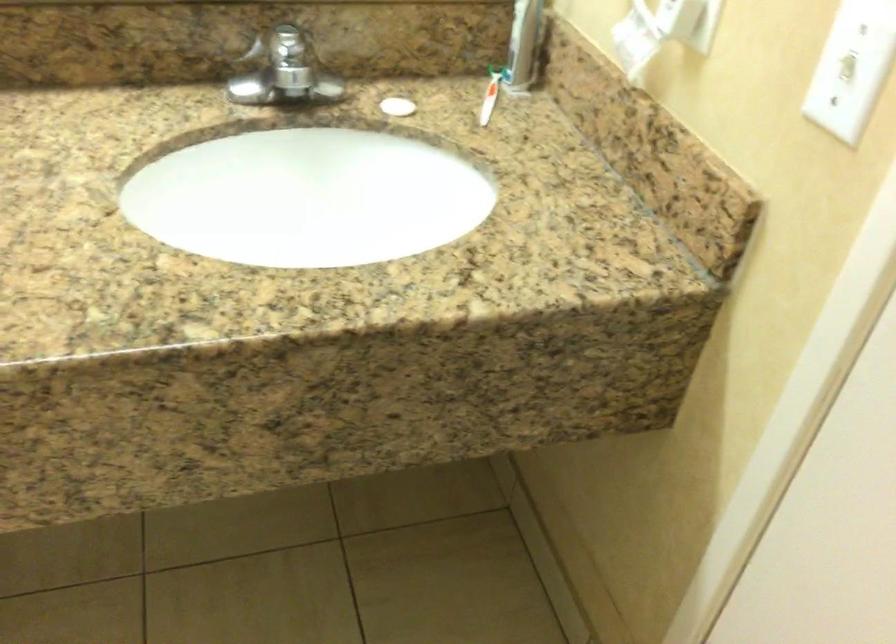
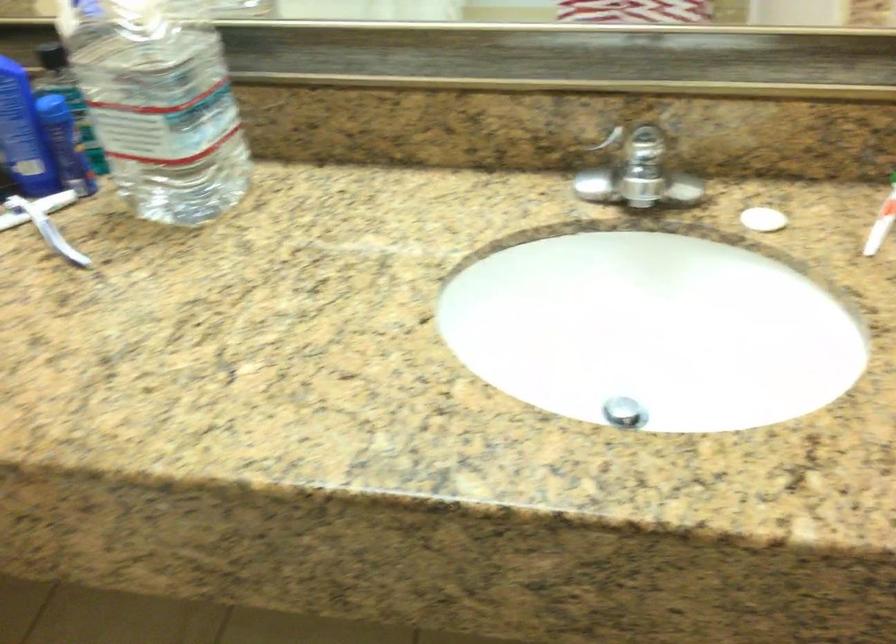
Find the pixel in the second image that matches [315,289] in the first image.

(624, 412)